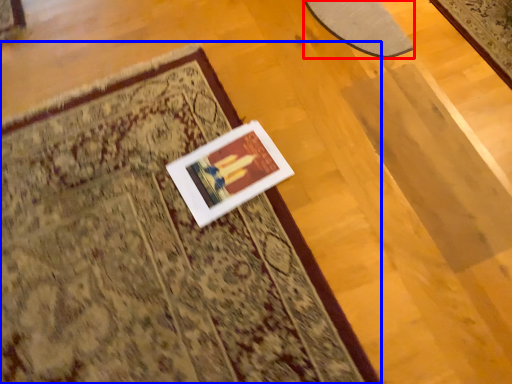
Question: Which point is closer to the camera, mat (highlighted by a red box) or mat (highlighted by a blue box)?

Choices:
 (A) mat
 (B) mat

Answer: (B)